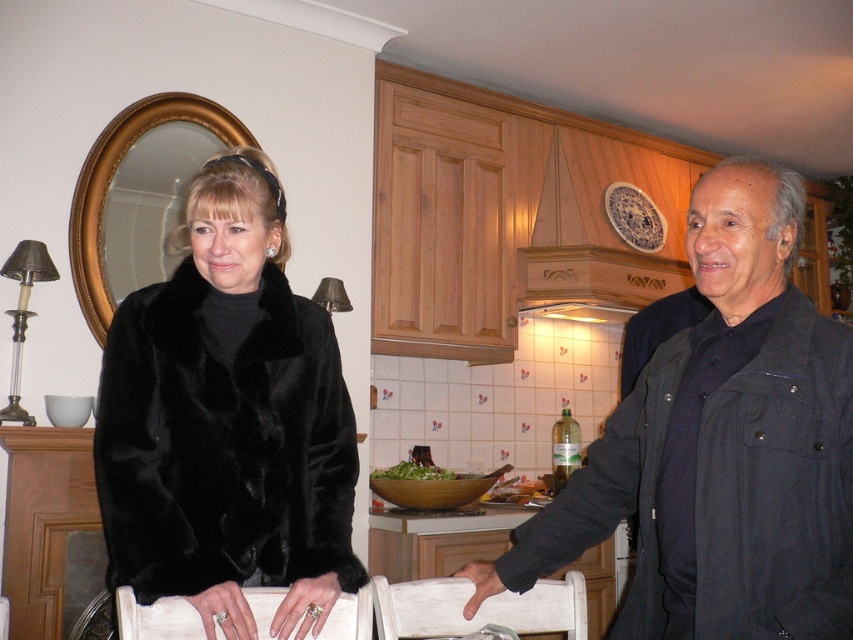
Question: Which point is closer to the camera?

Choices:
 (A) (297, 579)
 (B) (230, 524)
 (C) (374, 474)
 (D) (486, 570)

Answer: (B)

Question: Can you confirm if black fur coat at left is positioned below green leafy salad at center?

Choices:
 (A) yes
 (B) no

Answer: (B)

Question: Which point is closer to the camera taking this photo?

Choices:
 (A) (491, 573)
 (B) (375, 474)
 (C) (155, 307)

Answer: (C)

Question: Which point appears closest to the camera in this image?

Choices:
 (A) (490, 564)
 (B) (354, 436)

Answer: (A)

Question: From the image, what is the correct spatial relationship of black fur coat at upper left in relation to smooth skin hand at lower center?

Choices:
 (A) below
 (B) above

Answer: (B)

Question: Can you confirm if black fur coat at upper left is smaller than black fur coat at left?

Choices:
 (A) yes
 (B) no

Answer: (B)